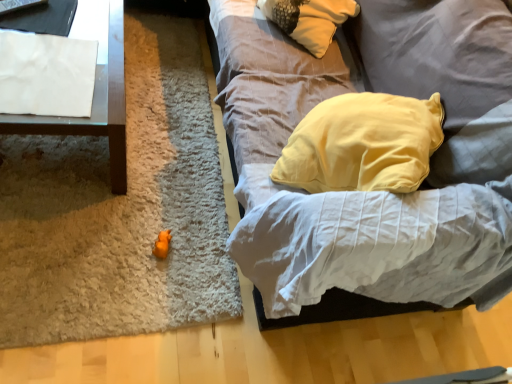
Locate an element on the screen. Image resolution: width=512 pixels, height=384 pixels. free space to the back side of orange rubber duck at center is located at coordinates (182, 210).